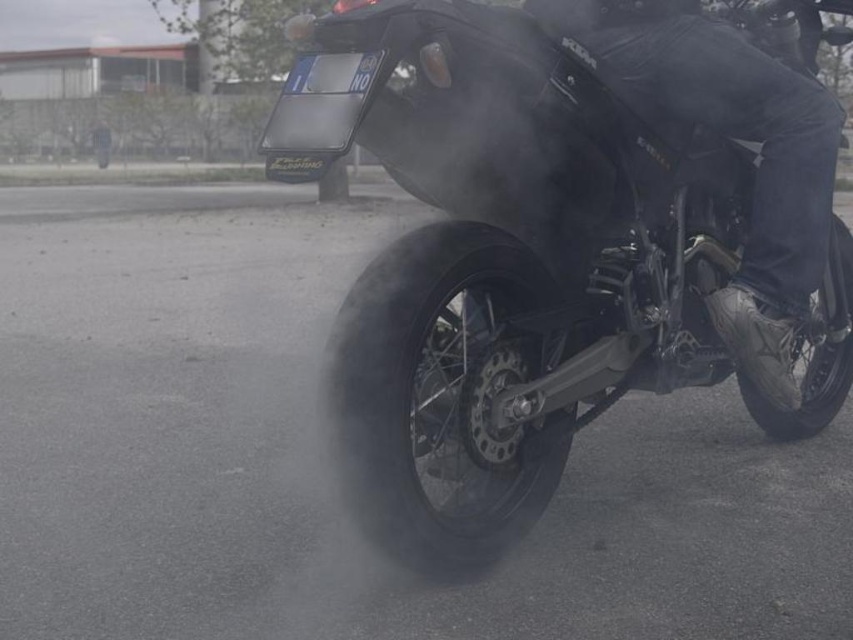
Who is more distant from viewer, (x=450, y=264) or (x=397, y=276)?

Point (x=450, y=264)

Between point (554, 61) and point (386, 412), which one is positioned behind?

The point (554, 61) is more distant.

You are a GUI agent. You are given a task and a screenshot of the screen. Output one action in this format:
    pyautogui.click(x=<x>, y=<y>)
    Task: Click on the black matte motorcycle at center
    This screenshot has height=640, width=853.
    Given the screenshot: What is the action you would take?
    pyautogui.click(x=517, y=266)

Who is higher up, black matte motorcycle at center or black rubber tire at lower right?

black matte motorcycle at center

This screenshot has width=853, height=640. I want to click on black matte motorcycle at center, so click(x=517, y=266).

Locate an element on the screen. black matte motorcycle at center is located at coordinates (517, 266).

Between point (483, 467) and point (780, 426), which one is positioned behind?

Point (780, 426)

Is black rubber tire at lower center to the right of black rubber tire at lower right from the viewer's perspective?

In fact, black rubber tire at lower center is to the left of black rubber tire at lower right.

Is point (363, 426) positioned after point (817, 348)?

No, (363, 426) is closer to viewer.

You are a GUI agent. You are given a task and a screenshot of the screen. Output one action in this format:
    pyautogui.click(x=<x>, y=<y>)
    Task: Click on the black rubber tire at lower center
    The height and width of the screenshot is (640, 853).
    Given the screenshot: What is the action you would take?
    pyautogui.click(x=438, y=400)